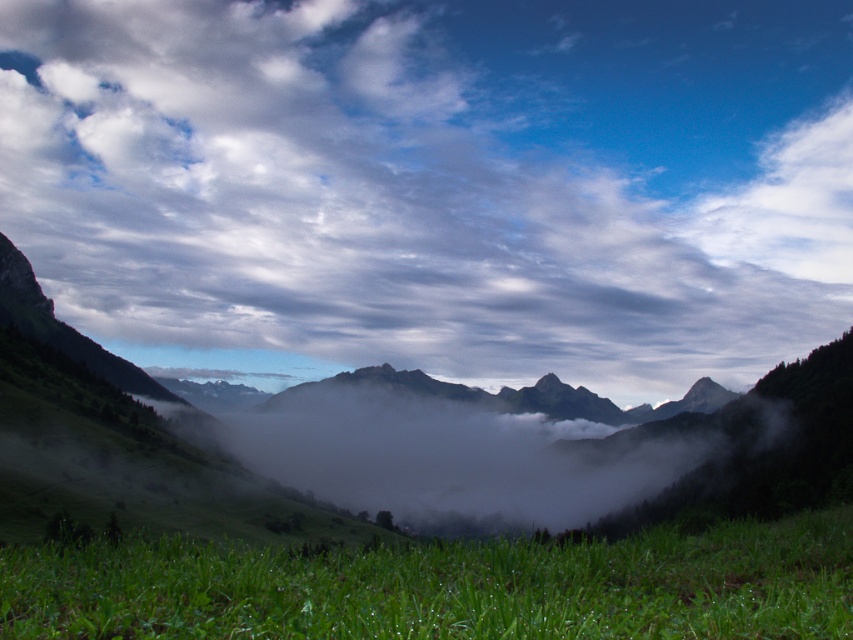
You are an artist planning to paint this landscape. You need to decide which area to focus on first based on their sizes. Which object should you start with, the cloudy sky at upper center or the green grassy at lower center?

The cloudy sky at upper center has a larger width than the green grassy at lower center, so you should start with the cloudy sky at upper center as it occupies more space in the painting.